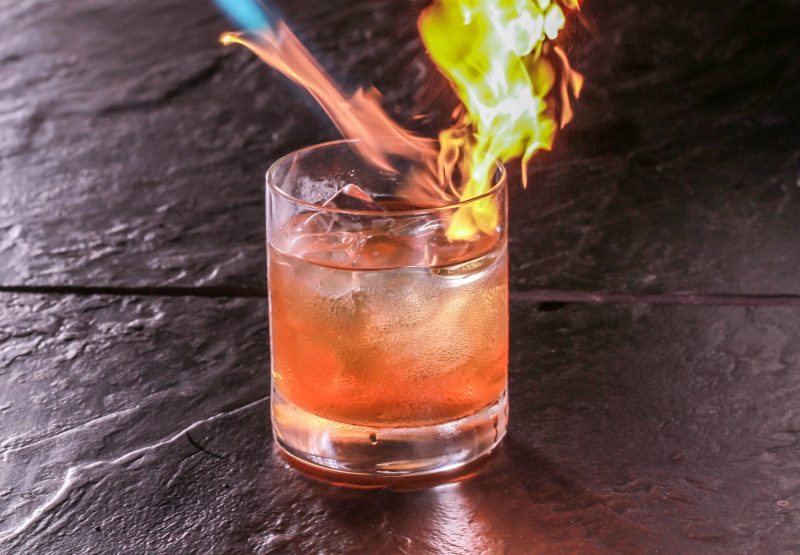
What are the coordinates of `bottom of glass` in the screenshot? It's located at coord(369,469).